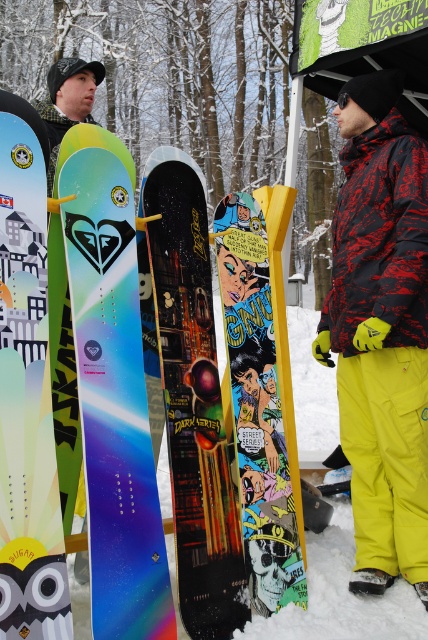
You are a snowboarder trying to choose between the matte black snowboard at left and the comic book yellow snowboard at center. Based on their sizes, which one would be easier to carry on your backpack?

The matte black snowboard at left is thinner than the comic book yellow snowboard at center, so it would be easier to carry on your backpack.

You are standing at the base of the snowy slope and want to reach the top. There are two marked points on the slope, point (181, 296) and point (284, 413). Which point is closer to your current position?

Point (181, 296) is closer to your current position because it is in front of point (284, 413).